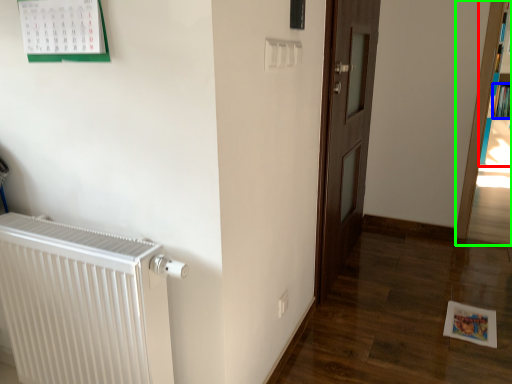
Question: Which object is positioned closest to bookcase (highlighted by a red box)? Select from book (highlighted by a blue box) and bookcase (highlighted by a green box).

Choices:
 (A) book
 (B) bookcase

Answer: (A)